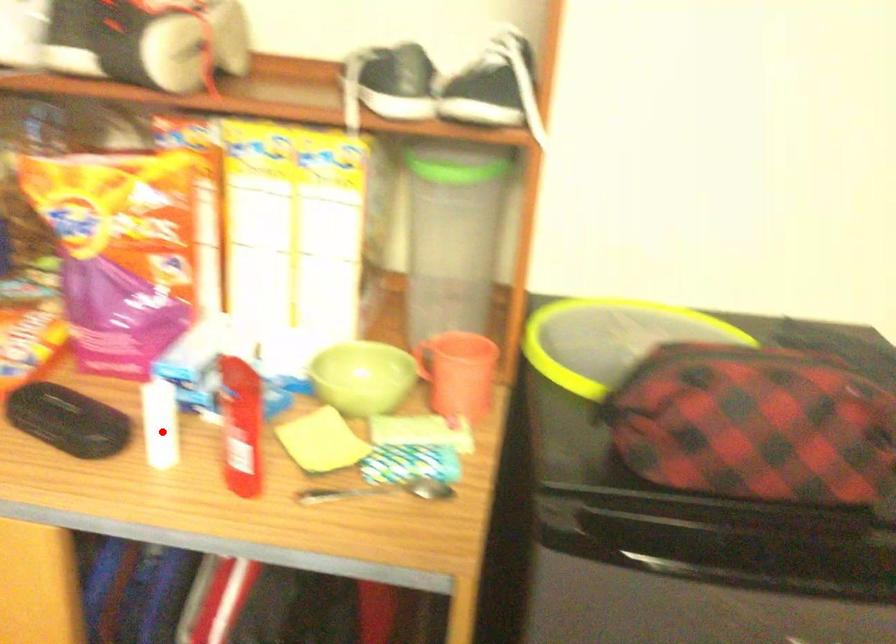
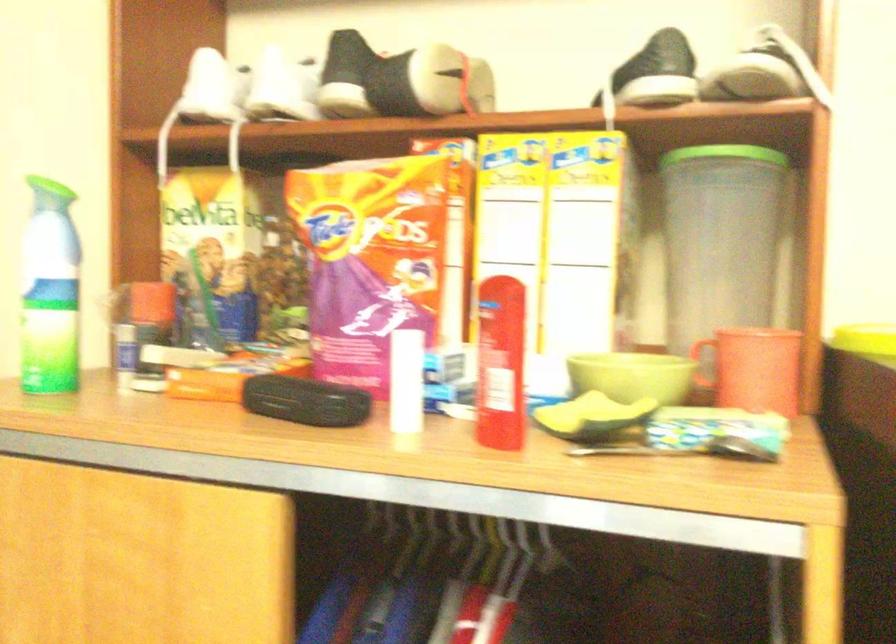
Question: I am providing you with two images of the same scene from different viewpoints. A red point is marked on the first image. At the location where the point appears in image 1, is it still visible in image 2?

Choices:
 (A) Yes
 (B) No

Answer: (A)